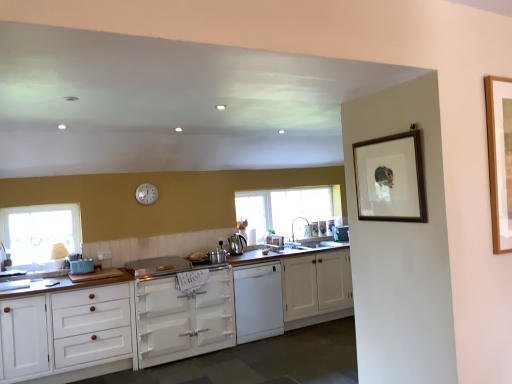
Find the location of a particular element. This screenshot has height=384, width=512. free location in front of polished stainless steel kettle at center is located at coordinates (234, 253).